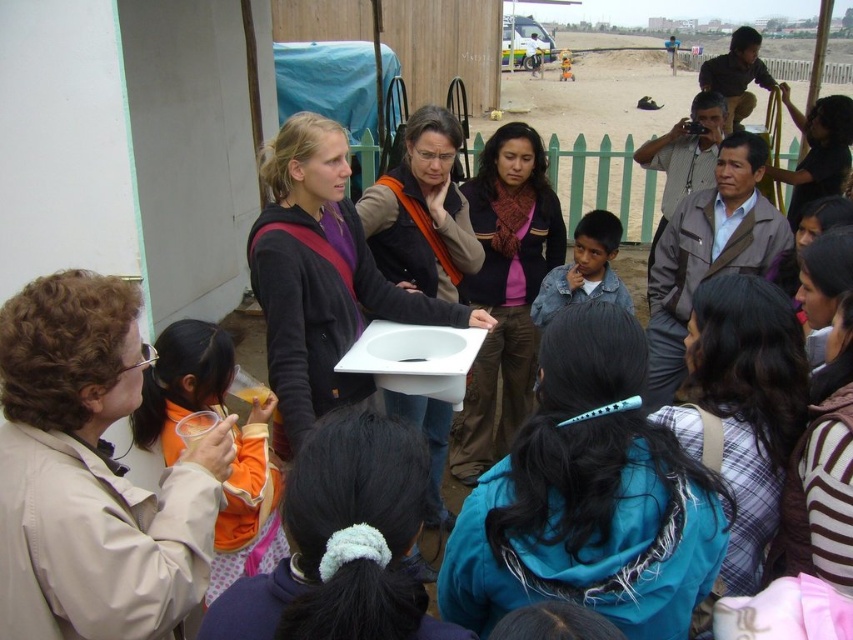
Question: Which is nearer to the orange fabric shirt at left?

Choices:
 (A) matte black sink at center
 (B) teal fabric hair clip at center
 (C) matte black jacket at upper right
 (D) matte brown vest at center

Answer: (A)

Question: Is beige fabric jacket at lower left below orange fabric shirt at left?

Choices:
 (A) yes
 (B) no

Answer: (B)

Question: Considering the real-world distances, which object is farthest from the orange fabric shirt at left?

Choices:
 (A) matte brown vest at center
 (B) denim jacket at center

Answer: (B)

Question: Does beige fabric jacket at lower left appear under matte black jacket at upper right?

Choices:
 (A) no
 (B) yes

Answer: (B)

Question: Which object is farther from the camera taking this photo?

Choices:
 (A) teal fabric hair clip at center
 (B) blue fabric ponytail at center

Answer: (A)

Question: Where is beige fabric jacket at lower left located in relation to teal fabric hair clip at center in the image?

Choices:
 (A) right
 (B) left

Answer: (B)